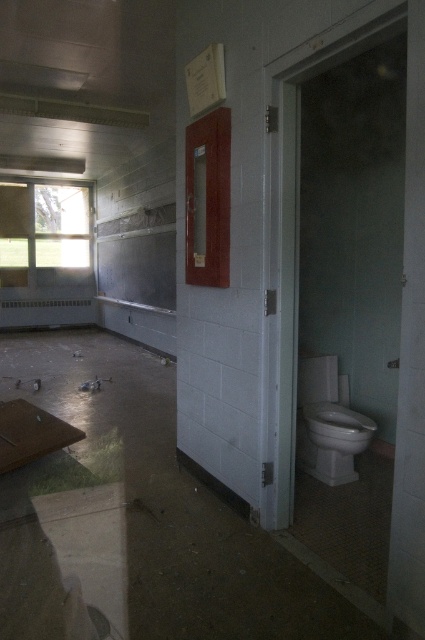
Question: Is wooden frame at upper center below white glossy toilet at lower right?

Choices:
 (A) no
 (B) yes

Answer: (A)

Question: From the image, what is the correct spatial relationship of wooden frame at upper center in relation to white glossy toilet at lower right?

Choices:
 (A) above
 (B) below

Answer: (A)

Question: Considering the relative positions of wooden frame at upper center and white glossy toilet at lower right in the image provided, where is wooden frame at upper center located with respect to white glossy toilet at lower right?

Choices:
 (A) right
 (B) left

Answer: (B)

Question: Which point appears closest to the camera in this image?

Choices:
 (A) (221, 170)
 (B) (340, 480)

Answer: (A)

Question: Which object appears closest to the camera in this image?

Choices:
 (A) wooden frame at upper center
 (B) white glossy toilet at lower right

Answer: (A)

Question: Which object appears farthest from the camera in this image?

Choices:
 (A) wooden frame at upper center
 (B) white glossy toilet at lower right

Answer: (B)